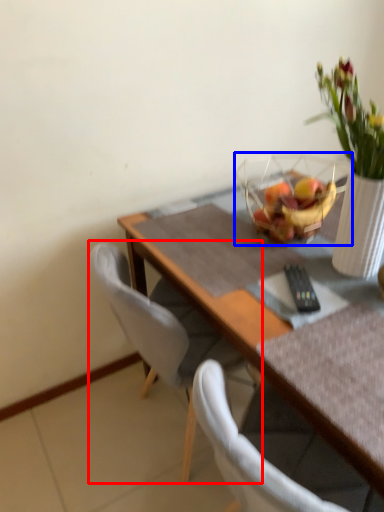
Question: Which of the following is the closest to the observer, chair (highlighted by a red box) or basket (highlighted by a blue box)?

Choices:
 (A) chair
 (B) basket

Answer: (A)